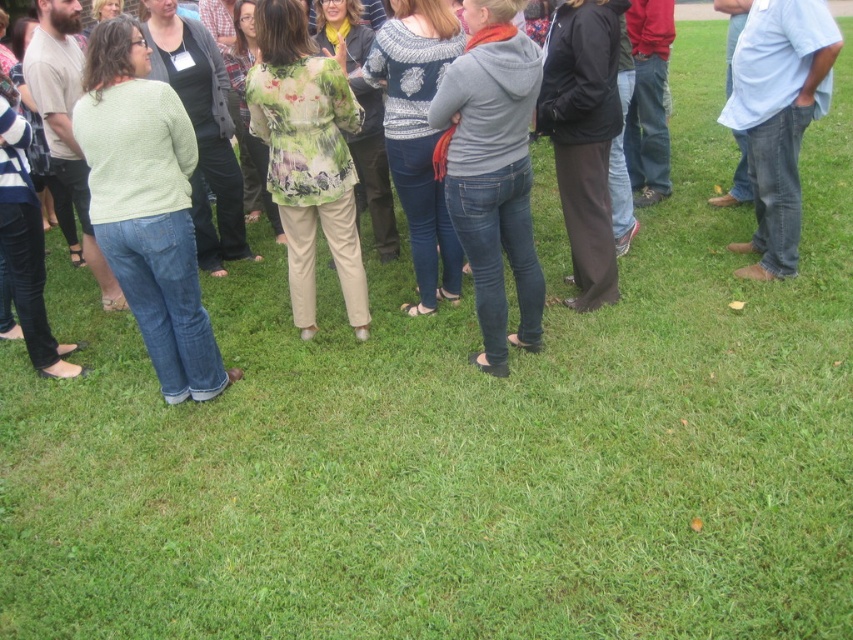
Describe the element at coordinates (306, 156) in the screenshot. I see `floral-patterned blouse at center` at that location.

Does point (282, 145) lie in front of point (827, 26)?

Yes.

Where is `floral-patterned blouse at center`? This screenshot has width=853, height=640. floral-patterned blouse at center is located at coordinates (306, 156).

Can you confirm if light green knitted sweater at center is taller than gray fleece hoodie at center?

Yes, light green knitted sweater at center is taller than gray fleece hoodie at center.

Is light green knitted sweater at center thinner than gray fleece hoodie at center?

No, light green knitted sweater at center is not thinner than gray fleece hoodie at center.

Describe the element at coordinates (148, 205) in the screenshot. I see `light green knitted sweater at center` at that location.

Where is `light green knitted sweater at center`? The height and width of the screenshot is (640, 853). light green knitted sweater at center is located at coordinates [x=148, y=205].

Which is more to the right, gray fleece hoodie at center or floral-patterned blouse at center?

From the viewer's perspective, gray fleece hoodie at center appears more on the right side.

Can you confirm if gray fleece hoodie at center is thinner than floral-patterned blouse at center?

Correct, gray fleece hoodie at center's width is less than floral-patterned blouse at center's.

I want to click on gray fleece hoodie at center, so click(x=492, y=170).

Find the location of `gray fleece hoodie at center`. gray fleece hoodie at center is located at coordinates (492, 170).